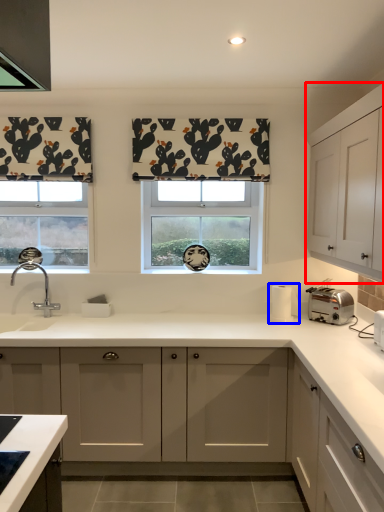
Question: Which of the following is the farthest to the observer, cabinetry (highlighted by a red box) or appliance (highlighted by a blue box)?

Choices:
 (A) cabinetry
 (B) appliance

Answer: (B)